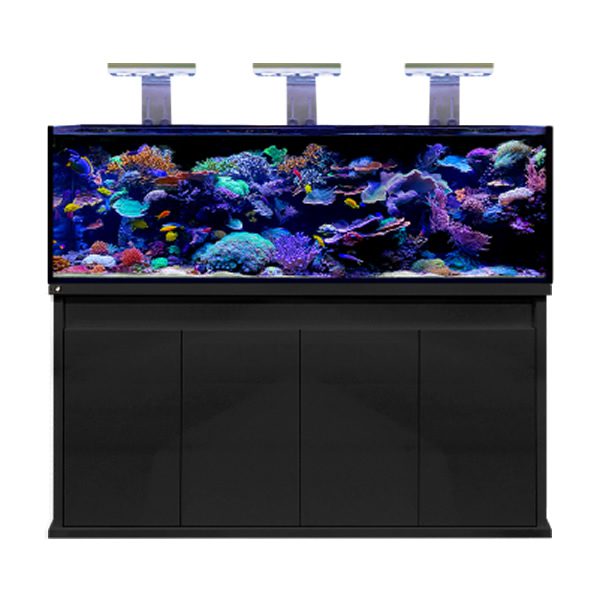
Locate an element on the screen. This screenshot has width=600, height=600. black base of fish tank is located at coordinates (234, 387).